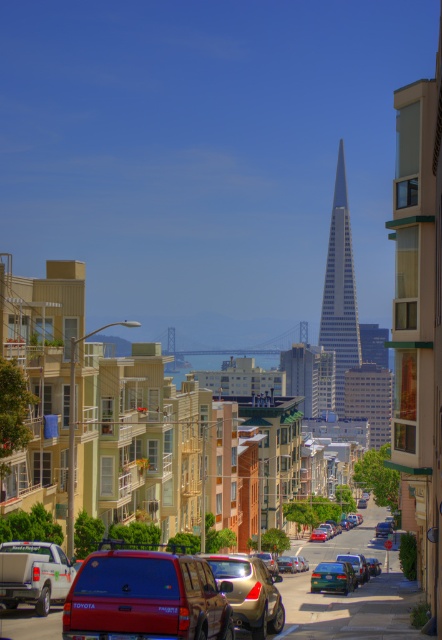
Who is positioned more to the right, metallic red van at center or metallic silver sedan at center?

metallic silver sedan at center is more to the right.

Is metallic red van at center wider than metallic silver sedan at center?

No, metallic red van at center is not wider than metallic silver sedan at center.

What do you see at coordinates (145, 598) in the screenshot? I see `metallic red van at center` at bounding box center [145, 598].

Identify the location of metallic red van at center. Image resolution: width=442 pixels, height=640 pixels. (145, 598).

Does metallic red van at center appear on the right side of glassy steel skyscraper at center?

In fact, metallic red van at center is to the left of glassy steel skyscraper at center.

Which is behind, point (190, 600) or point (350, 323)?

The point (350, 323) is more distant.

Locate an element on the screen. The image size is (442, 640). metallic red van at center is located at coordinates (145, 598).

Between point (48, 545) and point (388, 528), which one is positioned in front?

Point (48, 545) is in front.

From the picture: Measure the distance from green matte pickup truck at lower left to metallic silver sedan at center.

green matte pickup truck at lower left is 542.29 feet away from metallic silver sedan at center.

Identify the location of green matte pickup truck at lower left. The image size is (442, 640). (34, 573).